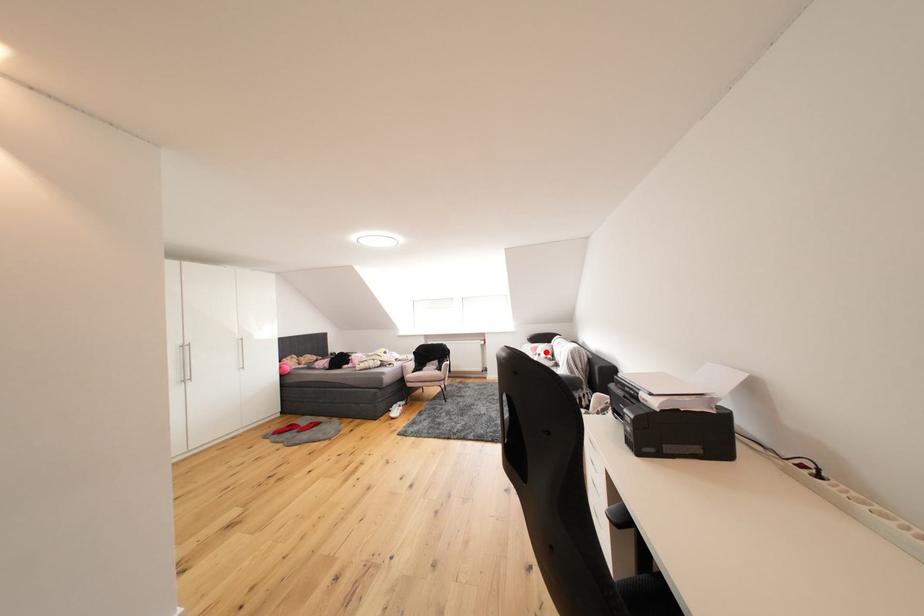
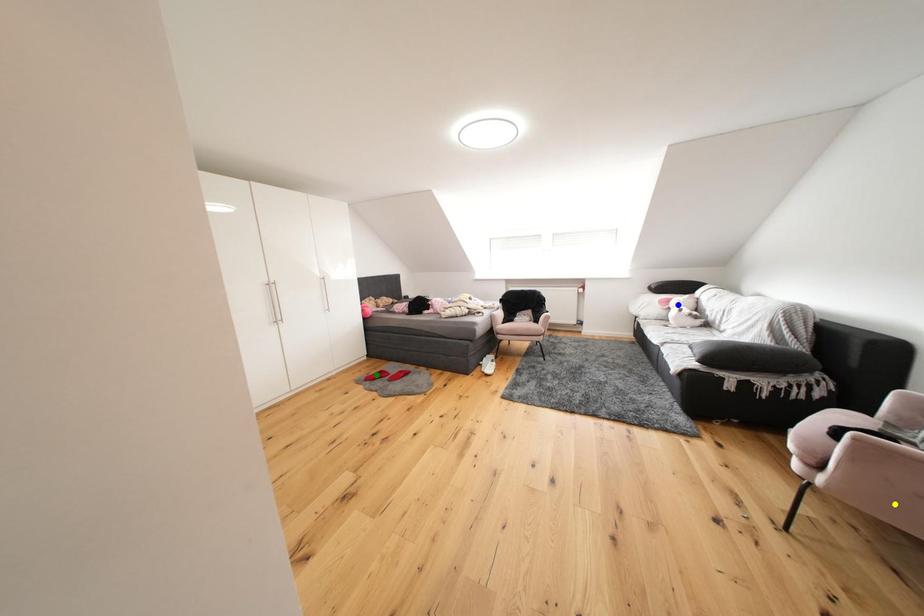
Question: I am providing you with two images of the same scene from different viewpoints. A red point is marked on the first image. You are given multiple points on the second image. Which point in image 2 represents the same 3d spot as the red point in image 1?

Choices:
 (A) yellow point
 (B) green point
 (C) blue point

Answer: (C)